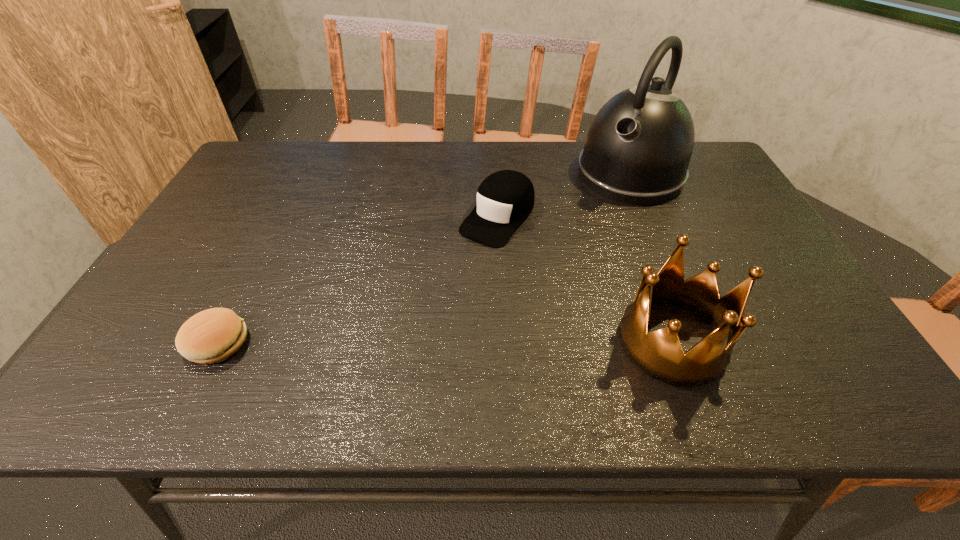
This screenshot has width=960, height=540. What are the coordinates of `blank space located 0.340m on the front-facing side of the third object from right to left` in the screenshot? It's located at (399, 334).

Locate an element on the screen. Image resolution: width=960 pixels, height=540 pixels. free space located 0.300m on the spout of the tallest object is located at coordinates (557, 256).

I want to click on free space located 0.140m on the spout of the tallest object, so click(586, 224).

What are the coordinates of `free location located on the spout of the tallest object` in the screenshot? It's located at (600, 208).

Where is `object located at the far edge`? object located at the far edge is located at coordinates (638, 148).

Find the location of a particular element. The width and height of the screenshot is (960, 540). patty that is at the near edge is located at coordinates (213, 335).

Locate an element on the screen. crown situated at the near edge is located at coordinates click(659, 354).

Locate an element on the screen. The height and width of the screenshot is (540, 960). object situated at the left edge is located at coordinates (213, 335).

This screenshot has width=960, height=540. Identify the location of object located in the right edge section of the desktop. (638, 148).

Identify the location of object located at the near left corner. The image size is (960, 540). (213, 335).